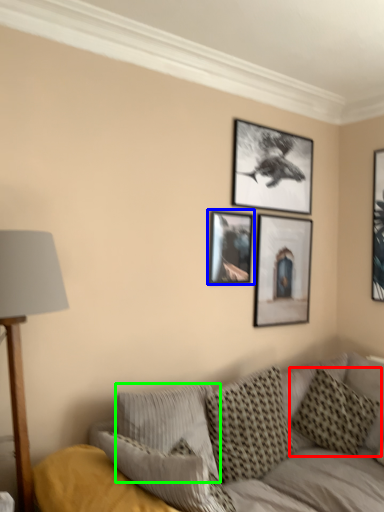
Question: Which object is the farthest from pillow (highlighted by a red box)? Choose among these: picture frame (highlighted by a blue box) or pillow (highlighted by a green box).

Choices:
 (A) picture frame
 (B) pillow

Answer: (A)